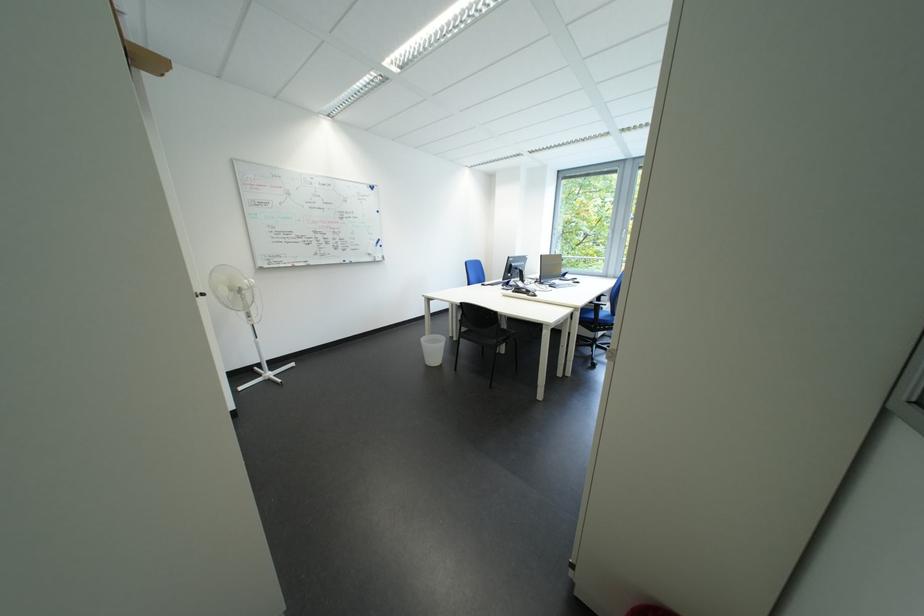
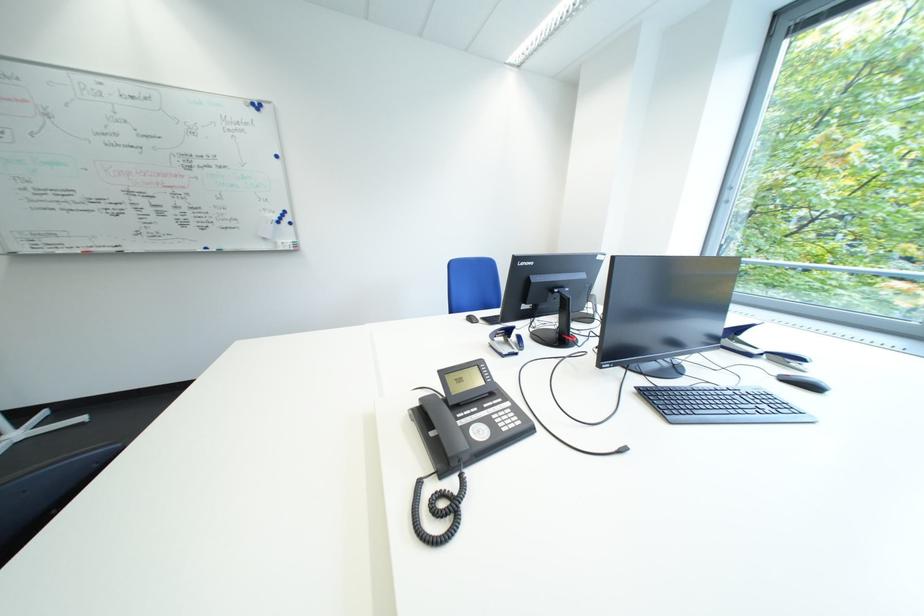
What movement of the cameraman would produce the second image?

The cameraman walked toward right, forward.